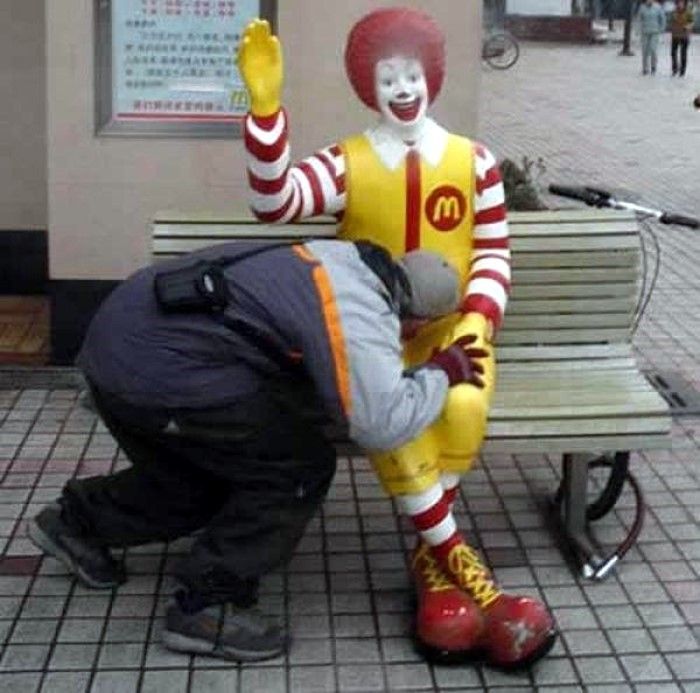
Find the location of `bench`. bench is located at coordinates (x=531, y=351), (x=563, y=402), (x=567, y=283).